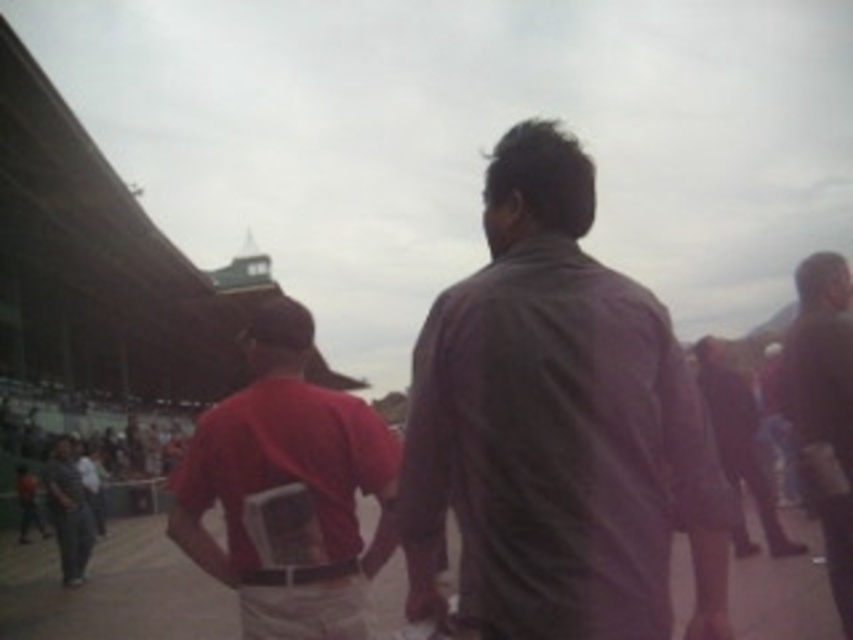
You are a photographer trying to capture a candid shot of the dark brown leather jacket at center and the dark gray fabric pants at lower left. Since you want to focus on the jacket, which object should you prioritize positioning closer to the camera?

The dark brown leather jacket at center has a greater height compared to the dark gray fabric pants at lower left, so to focus on the jacket, you should position the dark brown leather jacket at center closer to the camera.

You are a photographer trying to capture the scene. You notice the dark brown shirt at center and the dark gray fabric pants at lower left. Which object would appear narrower in your photo?

The dark brown shirt at center would appear narrower in the photo since it is thinner than the dark gray fabric pants at lower left.

You are standing in the scene and want to walk towards the point closer to you. Which point should you walk towards, point (718, 573) or point (70, 467)?

You should walk towards point (718, 573) because it is closer to you than point (70, 467).